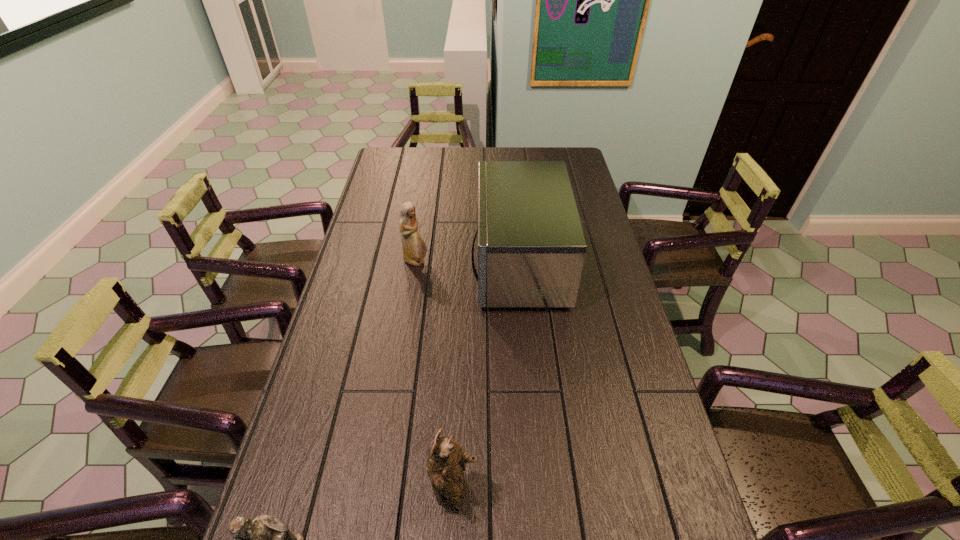
The height and width of the screenshot is (540, 960). I want to click on object located in the right edge section of the desktop, so click(x=531, y=245).

Identify the location of vacant space at the left edge of the desktop. (390, 217).

This screenshot has height=540, width=960. In order to click on vacant space at the right edge in this screenshot , I will do `click(614, 326)`.

The height and width of the screenshot is (540, 960). What are the coordinates of `vacant space at the far left corner of the desktop` in the screenshot? It's located at (387, 151).

Locate an element on the screen. The image size is (960, 540). free space between the rightmost figurine and the farthest figurine is located at coordinates (436, 378).

The height and width of the screenshot is (540, 960). What are the coordinates of `free space between the microwave oven and the third object from right to left` in the screenshot? It's located at click(468, 262).

The image size is (960, 540). Identify the location of vacant point located between the farthest figurine and the microwave oven. (468, 262).

You are a GUI agent. You are given a task and a screenshot of the screen. Output one action in this format:
    pyautogui.click(x=<x>, y=<y>)
    Task: Click on the vacant area between the microwave oven and the farthest figurine
    This screenshot has height=540, width=960.
    Given the screenshot: What is the action you would take?
    pyautogui.click(x=468, y=262)

The width and height of the screenshot is (960, 540). I want to click on unoccupied position between the second nearest object and the microwave oven, so click(x=488, y=379).

At what (x,y) coordinates should I click in order to perform the action: click on object that stands as the third closest to the farthest figurine. Please return your answer as a coordinate pair (x, y). The height and width of the screenshot is (540, 960). Looking at the image, I should click on (266, 539).